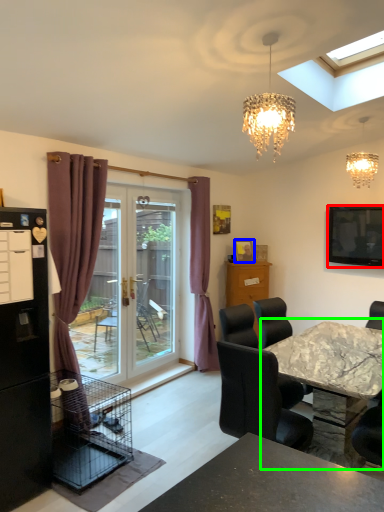
Question: Considering the real-world distances, which object is farthest from television (highlighted by a red box)? picture frame (highlighted by a blue box) or kitchen & dining room table (highlighted by a green box)?

Choices:
 (A) picture frame
 (B) kitchen & dining room table

Answer: (A)